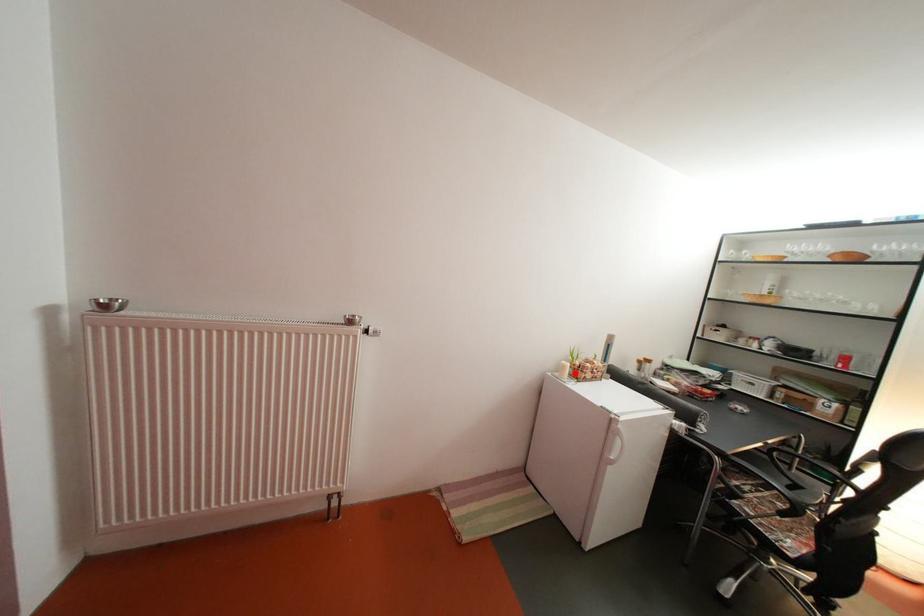
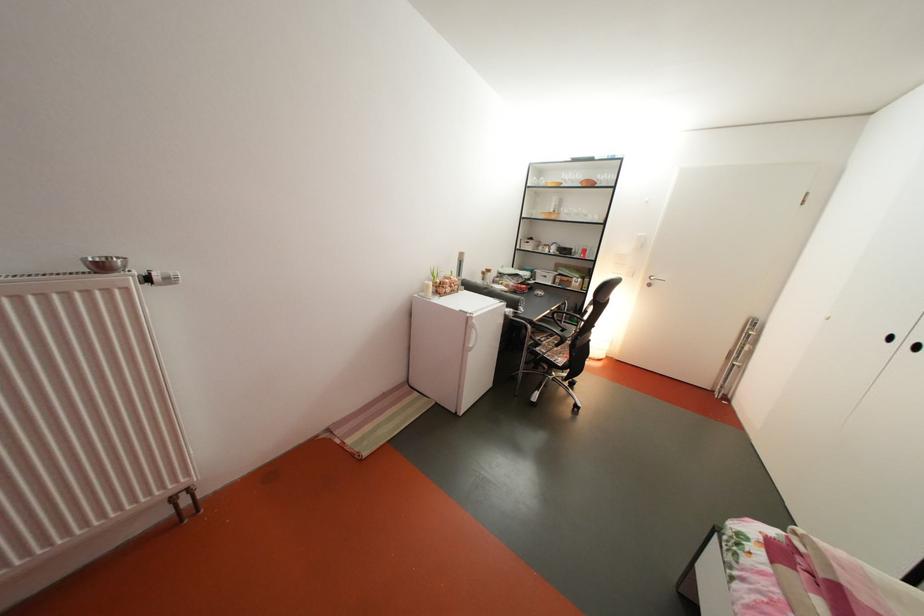
Find the pixel in the second image that matches the highlighted location in the first image.

(439, 293)